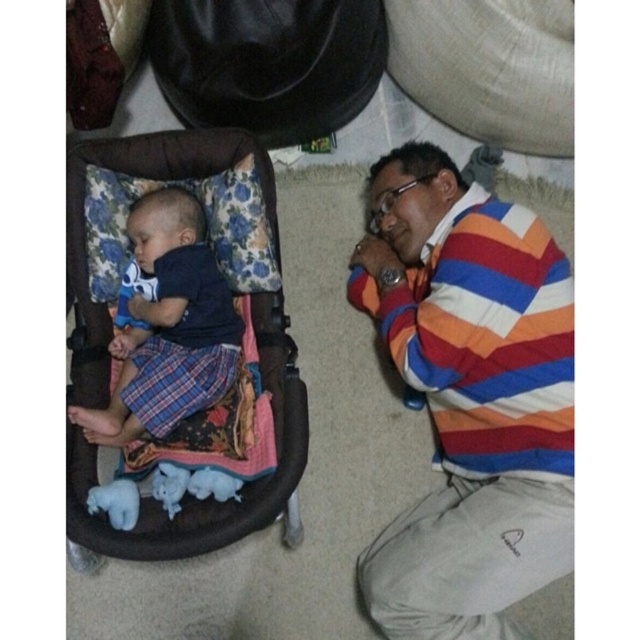
Who is positioned more to the left, striped cotton shirt at lower right or brown fabric baby carriage at center?

brown fabric baby carriage at center is more to the left.

Does point (408, 356) come farther from viewer compared to point (93, 336)?

No, it is not.

This screenshot has width=640, height=640. I want to click on striped cotton shirt at lower right, so click(x=468, y=396).

Can you confirm if striped cotton shirt at lower right is thinner than matte blue shirt at left?

No.

Does point (442, 152) lie in front of point (230, 305)?

No, it is not.

The image size is (640, 640). Identify the location of striped cotton shirt at lower right. (468, 396).

Which is in front, point (289, 470) or point (154, 276)?

Point (289, 470)

Is brown fabric baby carriage at center taller than matte blue shirt at left?

Yes.

What do you see at coordinates (212, 500) in the screenshot? This screenshot has height=640, width=640. I see `brown fabric baby carriage at center` at bounding box center [212, 500].

Locate an element on the screen. Image resolution: width=640 pixels, height=640 pixels. brown fabric baby carriage at center is located at coordinates (212, 500).